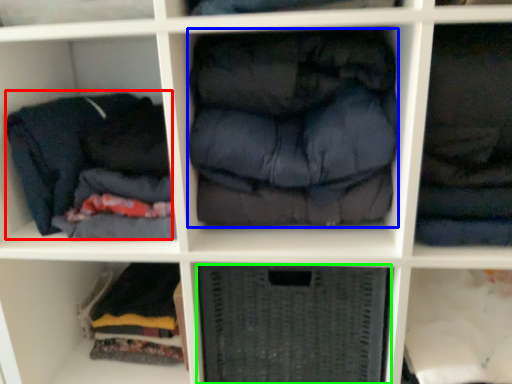
Question: Estimate the real-world distances between objects in this image. Which object is farther from clothing (highlighted by a red box), clothing (highlighted by a blue box) or shelf (highlighted by a green box)?

Choices:
 (A) clothing
 (B) shelf

Answer: (B)